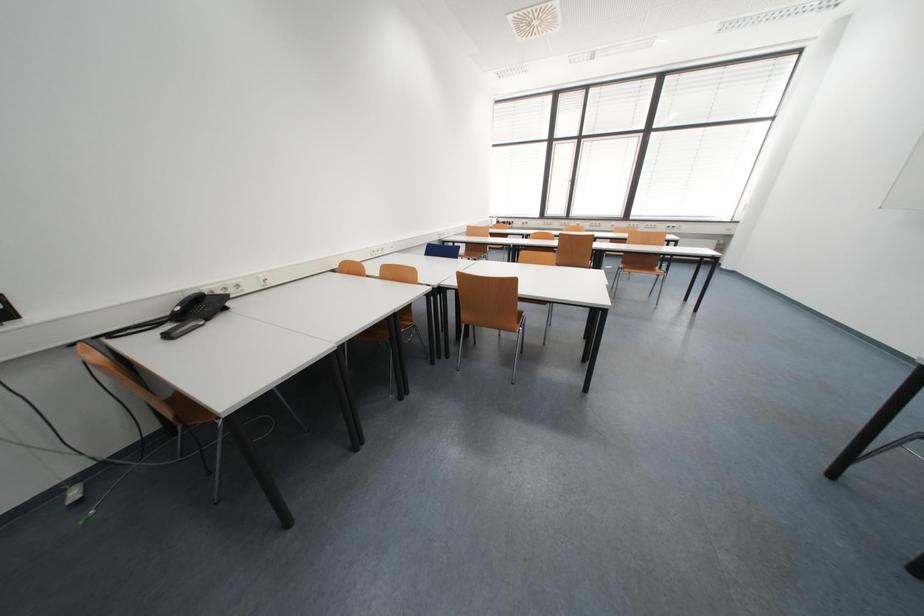
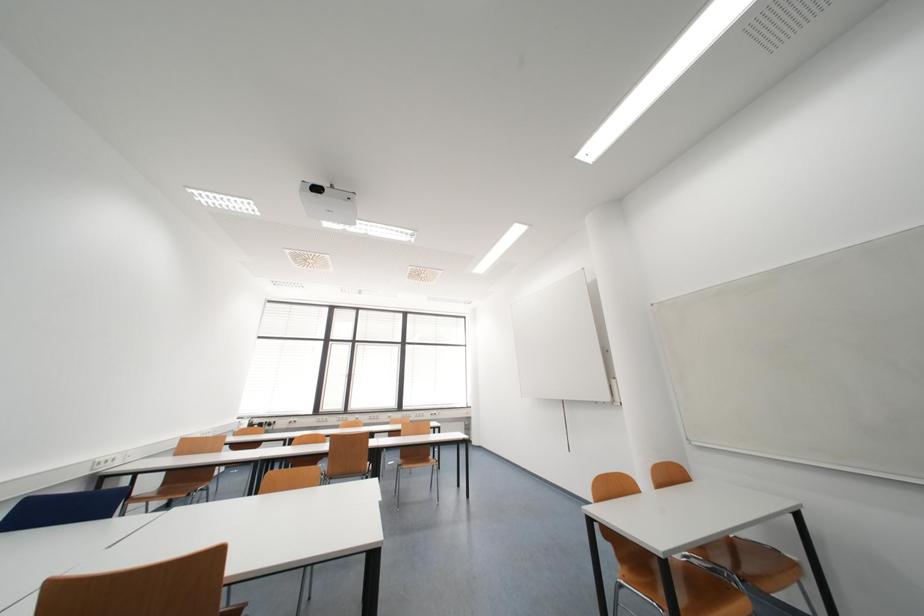
How did the camera likely rotate?

The camera's rotation is toward right-up.